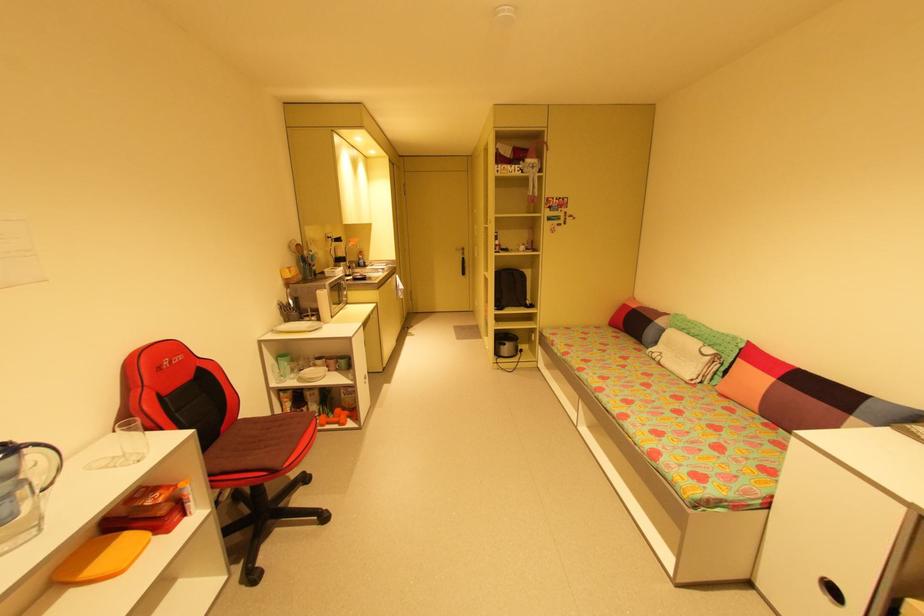
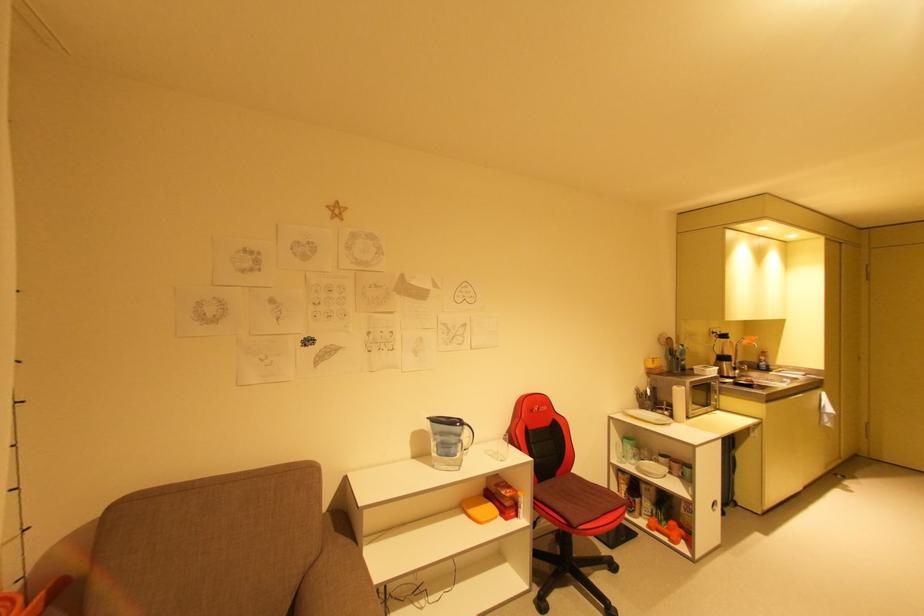
Locate, in the second image, the point that corresponds to [345,422] in the first image.

(675, 538)